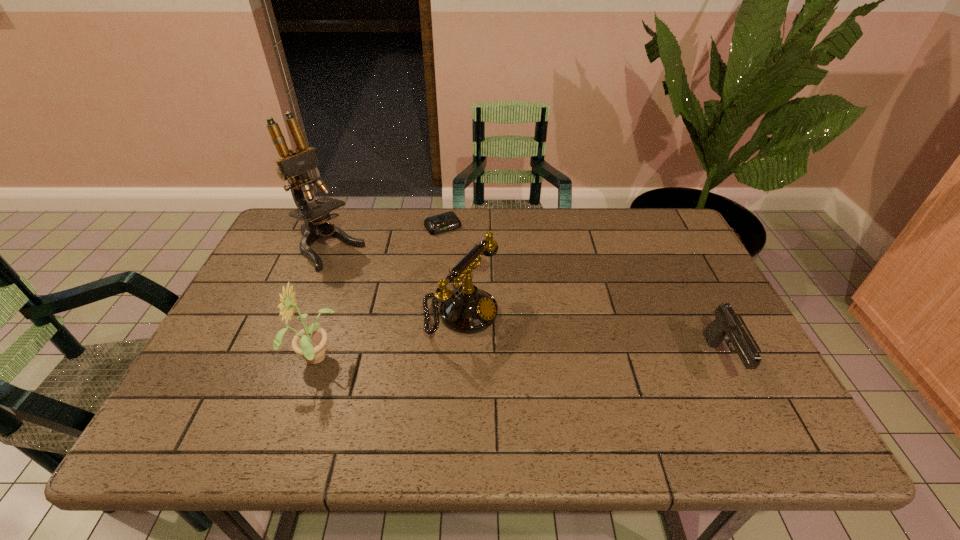
Locate an element on the screen. The image size is (960, 540). pistol that is at the near edge is located at coordinates (726, 323).

Find the location of a particular element. The width and height of the screenshot is (960, 540). object present at the left edge is located at coordinates (293, 165).

I want to click on object at the right edge, so click(726, 323).

Where is `object at the far left corner`? The width and height of the screenshot is (960, 540). object at the far left corner is located at coordinates pos(293,165).

At what (x,y) coordinates should I click in order to perform the action: click on object at the near right corner. Please return your answer as a coordinate pair (x, y). Image resolution: width=960 pixels, height=540 pixels. Looking at the image, I should click on (726, 323).

In the image, there is a desktop. Find the location of `free space at the far edge`. free space at the far edge is located at coordinates (610, 209).

Image resolution: width=960 pixels, height=540 pixels. In order to click on free space at the near edge in this screenshot , I will do (641, 372).

The height and width of the screenshot is (540, 960). In the image, there is a desktop. In order to click on vacant area at the left edge in this screenshot , I will do `click(228, 350)`.

In the image, there is a desktop. Where is `free space at the right edge`? This screenshot has width=960, height=540. free space at the right edge is located at coordinates (703, 289).

I want to click on vacant region at the far left corner of the desktop, so click(299, 248).